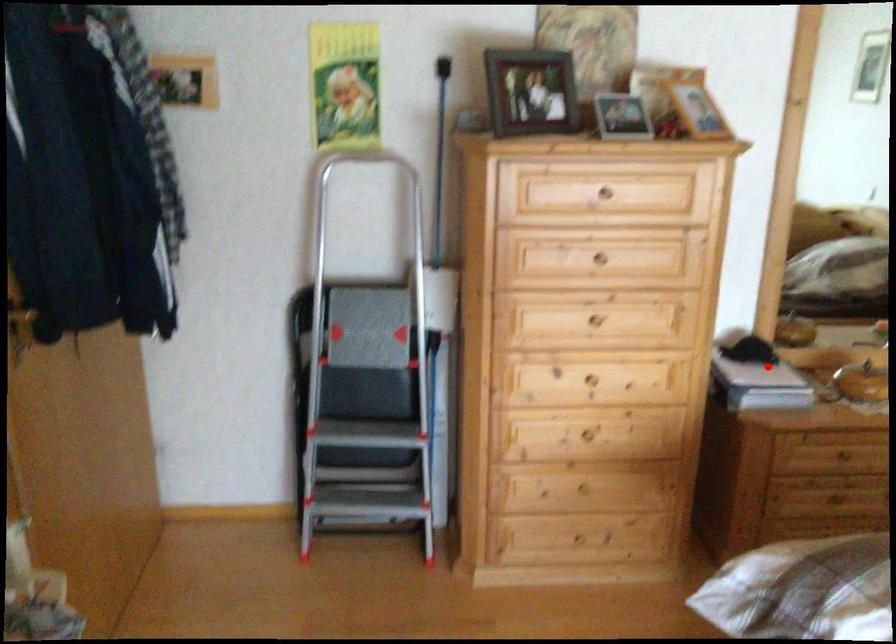
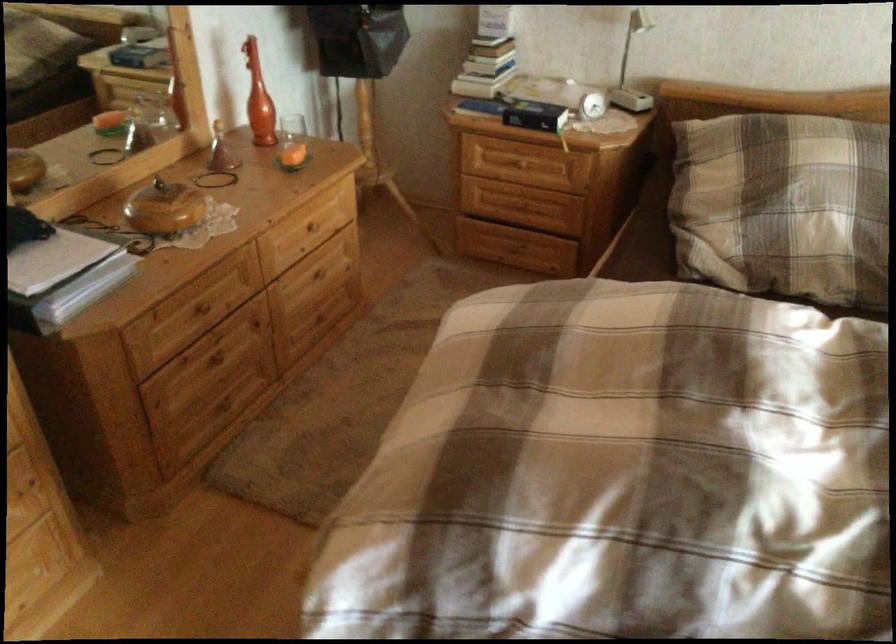
Question: I am providing you with two images of the same scene from different viewpoints. A red point is shown in image1. For the corresponding object point in image2, is it positioned nearer or farther from the camera?

Choices:
 (A) Nearer
 (B) Farther

Answer: (A)